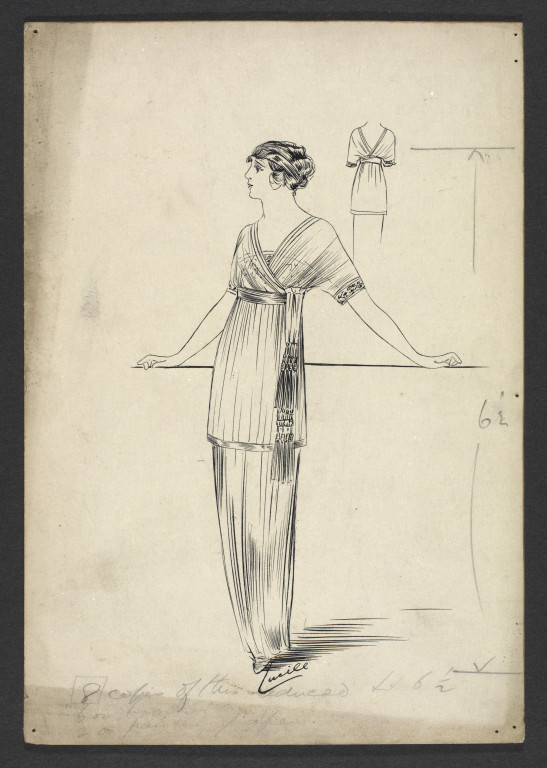
I want to click on pushpin marks for hanging sketch, so click(x=494, y=730), click(x=515, y=727), click(x=34, y=730), click(x=34, y=32), click(x=517, y=394), click(x=515, y=34), click(x=515, y=61).